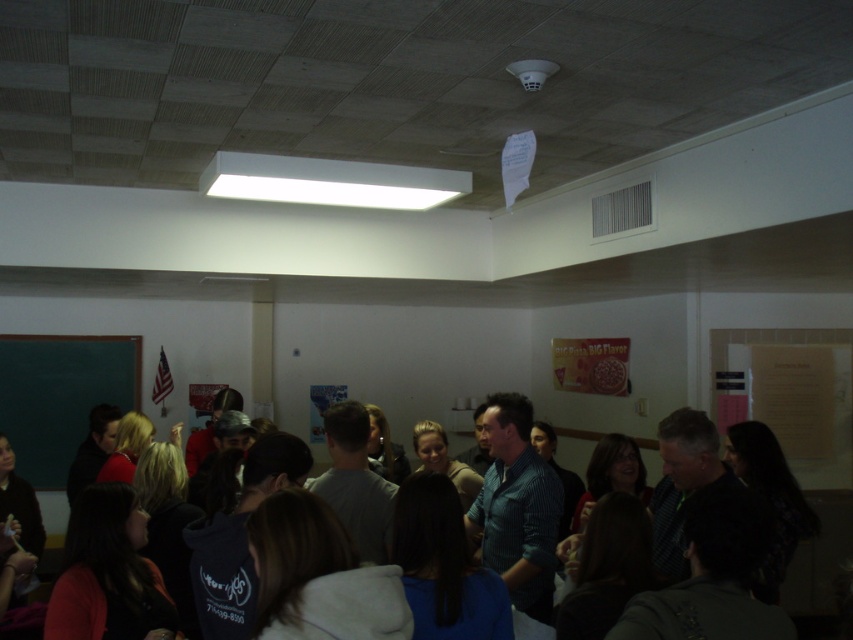
You are standing in the room and want to write a note on the green chalkboard at left. However, there is a person wearing the blue striped shirt at center in your way. Based on their positions, can you reach the chalkboard without moving the person?

The green chalkboard at left is positioned over blue striped shirt at center, meaning the chalkboard is above the person. Therefore, you can reach the chalkboard without moving the person since it is located above them.

You are standing in the room described. There is a point marked at coordinates (718, 483). What object or feature is located at that point?

The point at coordinates (718, 483) marks the blue denim shirt at center.